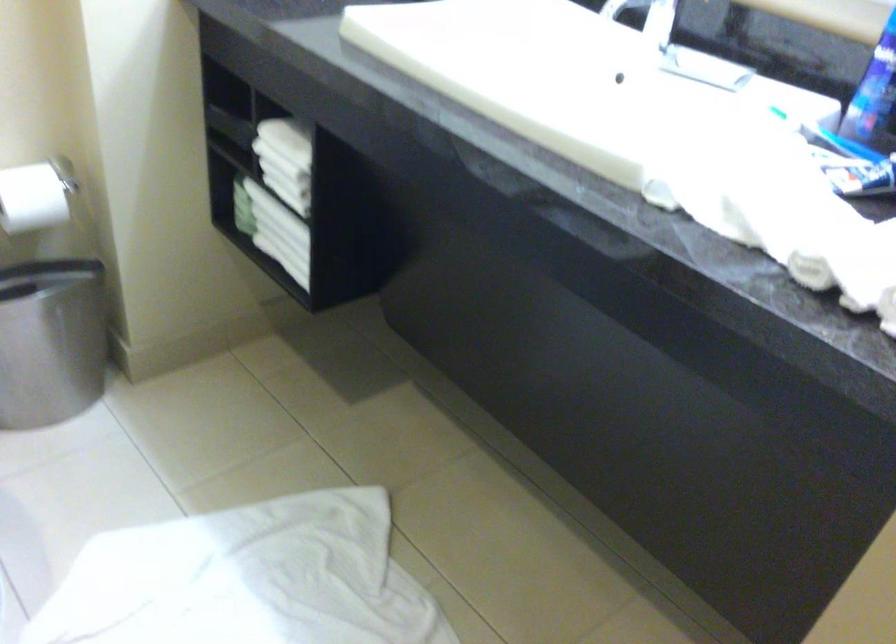
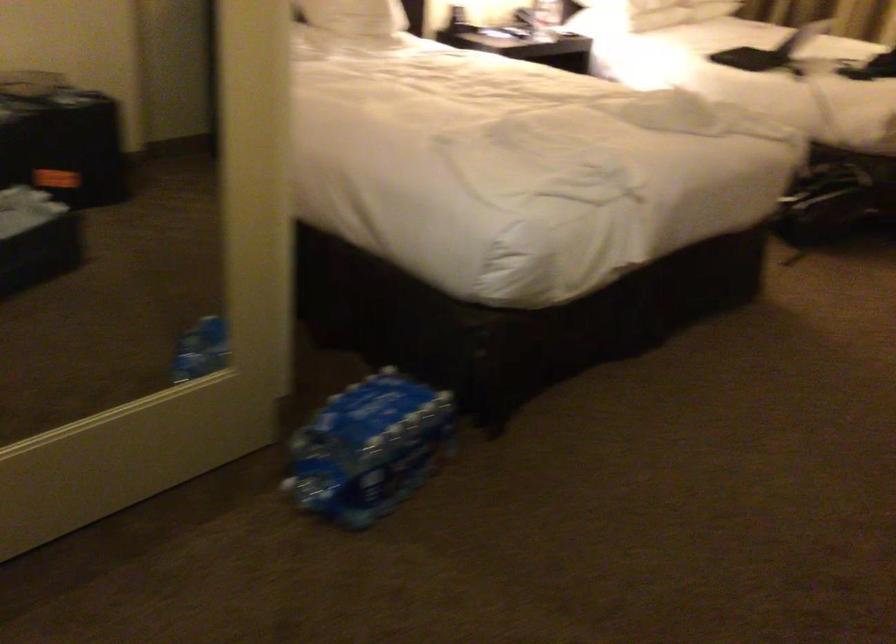
What movement of the cameraman would produce the second image?

The cameraman moved toward right, backward.